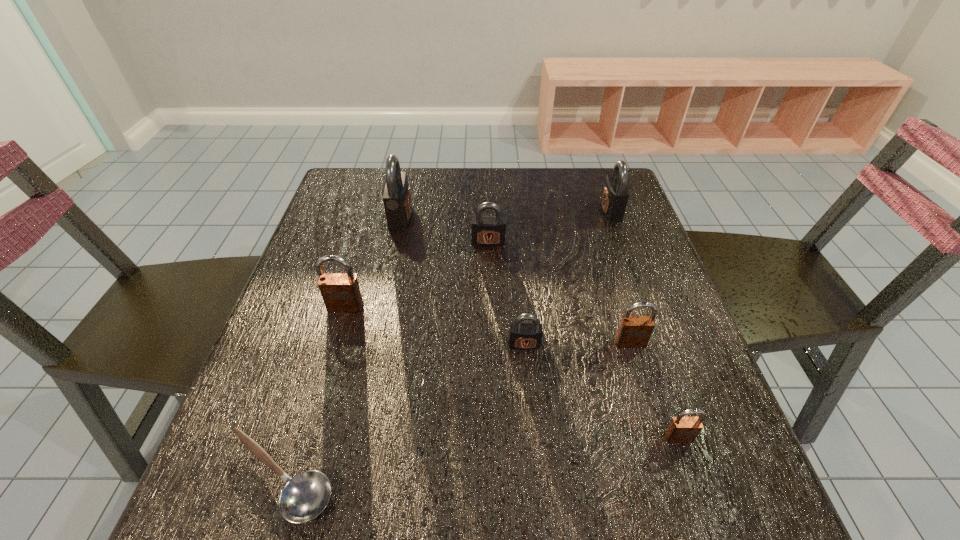
The width and height of the screenshot is (960, 540). I want to click on vacant area that lies between the second smallest brown padlock and the leftmost gray padlock, so click(x=516, y=280).

The width and height of the screenshot is (960, 540). Find the location of `empty space between the second biggest brown padlock and the nearest padlock`. empty space between the second biggest brown padlock and the nearest padlock is located at coordinates coord(655,390).

Where is `the fifth closest object to the smallest gray padlock`? The image size is (960, 540). the fifth closest object to the smallest gray padlock is located at coordinates (305, 496).

Locate which object ranks fifth in proximity to the second biggest gray padlock. Please provide its 2D coordinates. Your answer should be formatted as a tuple, i.e. [(x, y)], where the tuple contains the x and y coordinates of a point satisfying the conditions above.

[(681, 429)]

What are the coordinates of `the third closest padlock to the second biggest brown padlock` in the screenshot? It's located at point(487,231).

Locate which padlock ranks third in proximity to the nearest gray padlock. Please provide its 2D coordinates. Your answer should be formatted as a tuple, i.e. [(x, y)], where the tuple contains the x and y coordinates of a point satisfying the conditions above.

[(487, 231)]

Locate which gray padlock is the closest to the tallest padlock. Please provide its 2D coordinates. Your answer should be formatted as a tuple, i.e. [(x, y)], where the tuple contains the x and y coordinates of a point satisfying the conditions above.

[(487, 231)]

Identify which gray padlock is the third closest to the leftmost gray padlock. Please provide its 2D coordinates. Your answer should be formatted as a tuple, i.e. [(x, y)], where the tuple contains the x and y coordinates of a point satisfying the conditions above.

[(615, 195)]

The height and width of the screenshot is (540, 960). I want to click on the second closest brown padlock to the leftmost gray padlock, so click(634, 331).

Locate an element on the screen. the closest brown padlock relative to the tallest object is located at coordinates (341, 293).